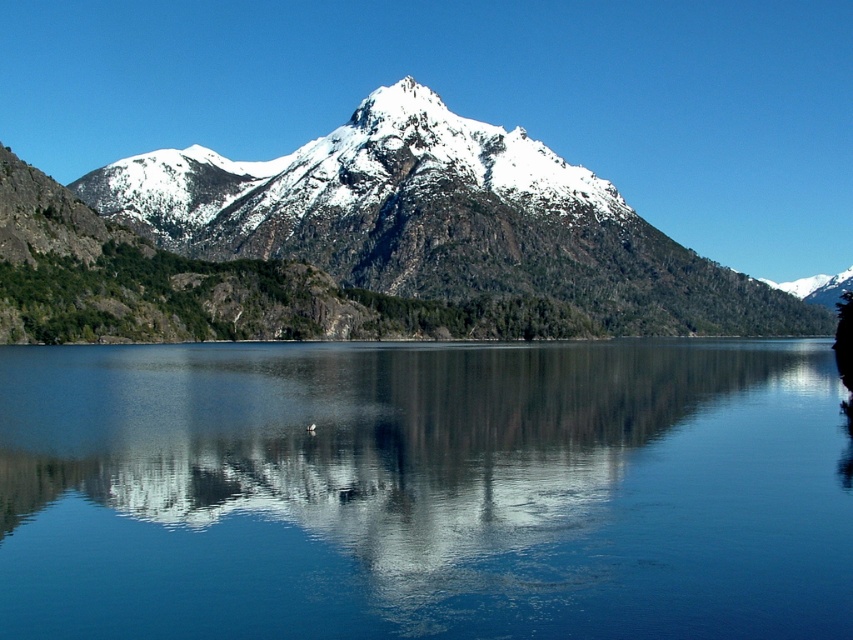
Question: Which object appears closest to the camera in this image?

Choices:
 (A) smooth blue water at center
 (B) snowy rocky mountain at center

Answer: (A)

Question: Which point is farther to the camera?

Choices:
 (A) (529, 356)
 (B) (189, 314)

Answer: (B)

Question: In this image, where is smooth blue water at center located relative to snowy rocky mountain at center?

Choices:
 (A) above
 (B) below

Answer: (B)

Question: Is smooth blue water at center to the left of snowy rocky mountain at center from the viewer's perspective?

Choices:
 (A) yes
 (B) no

Answer: (A)

Question: Can you confirm if smooth blue water at center is positioned above snowy rocky mountain at center?

Choices:
 (A) yes
 (B) no

Answer: (B)

Question: Among these objects, which one is nearest to the camera?

Choices:
 (A) smooth blue water at center
 (B) snowy rocky mountain at center

Answer: (A)